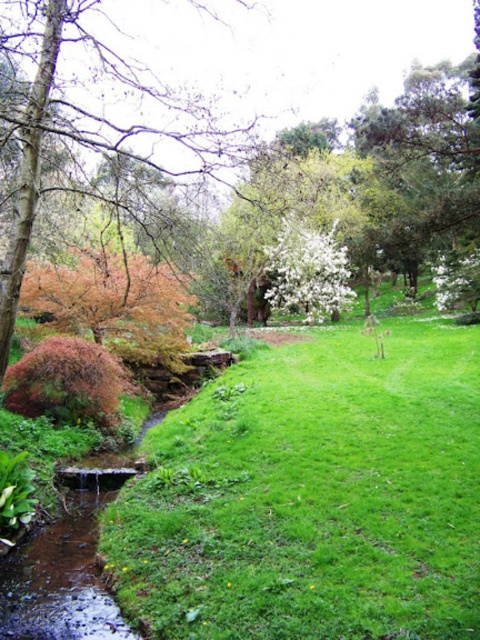
Question: Does orange-brown bark tree at left have a larger size compared to green textured tree at upper right?

Choices:
 (A) no
 (B) yes

Answer: (A)

Question: Which of the following is the farthest from the observer?

Choices:
 (A) orange-brown bark tree at left
 (B) green textured tree at upper right

Answer: (B)

Question: Which of the following is the farthest from the observer?

Choices:
 (A) green textured tree at upper right
 (B) orange-brown bark tree at left

Answer: (A)

Question: Where is orange-brown bark tree at left located in relation to green textured tree at upper right in the image?

Choices:
 (A) left
 (B) right

Answer: (A)

Question: Can you confirm if orange-brown bark tree at left is positioned above green textured tree at upper right?

Choices:
 (A) no
 (B) yes

Answer: (A)